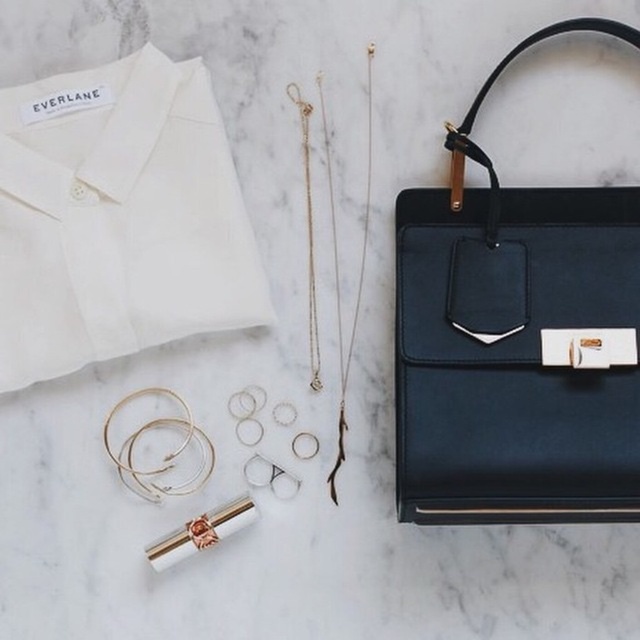
Image resolution: width=640 pixels, height=640 pixels. What do you see at coordinates (116, 218) in the screenshot? I see `white cotton dress shirt at upper left` at bounding box center [116, 218].

Describe the element at coordinates (116, 218) in the screenshot. Image resolution: width=640 pixels, height=640 pixels. I see `white cotton dress shirt at upper left` at that location.

You are a GUI agent. You are given a task and a screenshot of the screen. Output one action in this format:
    pyautogui.click(x=<x>, y=<y>)
    Task: Click on the white cotton dress shirt at upper left
    The image size is (640, 640).
    Given the screenshot: What is the action you would take?
    pyautogui.click(x=116, y=218)

Which is above, matte black leather handbag at right or metallic gold cigarette at lower left?

matte black leather handbag at right is above.

Describe the element at coordinates (516, 342) in the screenshot. I see `matte black leather handbag at right` at that location.

I want to click on matte black leather handbag at right, so click(516, 342).

Is matte black leather handbag at right further to camera compared to white cotton dress shirt at upper left?

No, it is not.

Is point (490, 214) closer to viewer compared to point (230, 257)?

Yes, point (490, 214) is closer to viewer.

The image size is (640, 640). Identify the location of matte black leather handbag at right. (516, 342).